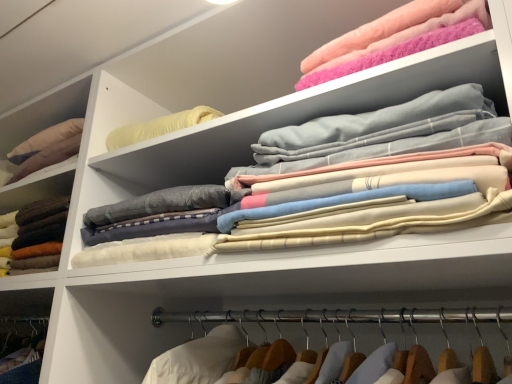
What do you see at coordinates (386, 202) in the screenshot? I see `soft cotton sheets at upper center, the 2th clothing when ordered from left to right` at bounding box center [386, 202].

Locate an element on the screen. soft wool sweater at left, which is the 3th clothing from right to left is located at coordinates (36, 236).

Could you tell me if fluffy pink towel at upper right, marked as the third clothing in a left-to-right arrangement, is turned towards soft wool sweater at left, placed as the 1th clothing when sorted from left to right?

No, fluffy pink towel at upper right, marked as the third clothing in a left-to-right arrangement, is not aimed at soft wool sweater at left, placed as the 1th clothing when sorted from left to right.

Is fluffy pink towel at upper right, arranged as the 1th clothing when viewed from the right, completely or partially outside of soft wool sweater at left, which is the 3th clothing from right to left?

That's correct, fluffy pink towel at upper right, arranged as the 1th clothing when viewed from the right, is outside of soft wool sweater at left, which is the 3th clothing from right to left.

Is fluffy pink towel at upper right, arranged as the 1th clothing when viewed from the right, wider or thinner than soft wool sweater at left, which is the 3th clothing from right to left?

Clearly, fluffy pink towel at upper right, arranged as the 1th clothing when viewed from the right, has less width compared to soft wool sweater at left, which is the 3th clothing from right to left.

From a real-world perspective, does fluffy pink towel at upper right, arranged as the 1th clothing when viewed from the right, stand above soft wool sweater at left, placed as the 1th clothing when sorted from left to right?

Correct, in the physical world, fluffy pink towel at upper right, arranged as the 1th clothing when viewed from the right, is higher than soft wool sweater at left, placed as the 1th clothing when sorted from left to right.

Starting from the soft wool sweater at left, placed as the 1th clothing when sorted from left to right, which clothing is the 2nd one in front? Please provide its 2D coordinates.

[(386, 202)]

Does soft wool sweater at left, placed as the 1th clothing when sorted from left to right, have a greater width compared to soft cotton sheets at upper center, the 2th clothing when ordered from left to right?

Yes.

Is soft wool sweater at left, which is the 3th clothing from right to left, touching soft cotton sheets at upper center, the 2th clothing when ordered from left to right?

soft wool sweater at left, which is the 3th clothing from right to left, is not next to soft cotton sheets at upper center, the 2th clothing when ordered from left to right, and they're not touching.

From the picture: Between soft wool sweater at left, placed as the 1th clothing when sorted from left to right, and soft cotton sheets at upper center, marked as the 2th clothing in a right-to-left arrangement, which one is positioned behind?

Positioned behind is soft wool sweater at left, placed as the 1th clothing when sorted from left to right.

Considering the positions of objects soft cotton sheets at upper center, marked as the 2th clothing in a right-to-left arrangement, and fluffy pink towel at upper right, arranged as the 1th clothing when viewed from the right, in the image provided, who is more to the left, soft cotton sheets at upper center, marked as the 2th clothing in a right-to-left arrangement, or fluffy pink towel at upper right, arranged as the 1th clothing when viewed from the right,?

From the viewer's perspective, soft cotton sheets at upper center, marked as the 2th clothing in a right-to-left arrangement, appears more on the left side.

Is soft cotton sheets at upper center, the 2th clothing when ordered from left to right, with fluffy pink towel at upper right, marked as the third clothing in a left-to-right arrangement?

No, soft cotton sheets at upper center, the 2th clothing when ordered from left to right, is not making contact with fluffy pink towel at upper right, marked as the third clothing in a left-to-right arrangement.

Is fluffy pink towel at upper right, arranged as the 1th clothing when viewed from the right, at the back of soft cotton sheets at upper center, the 2th clothing when ordered from left to right?

No, soft cotton sheets at upper center, the 2th clothing when ordered from left to right, is not facing away from fluffy pink towel at upper right, arranged as the 1th clothing when viewed from the right.

From the image's perspective, is fluffy pink towel at upper right, arranged as the 1th clothing when viewed from the right, on soft cotton sheets at upper center, marked as the 2th clothing in a right-to-left arrangement?

Indeed, from the image's perspective, fluffy pink towel at upper right, arranged as the 1th clothing when viewed from the right, is shown above soft cotton sheets at upper center, marked as the 2th clothing in a right-to-left arrangement.

Which object is wider, fluffy pink towel at upper right, marked as the third clothing in a left-to-right arrangement, or soft cotton sheets at upper center, the 2th clothing when ordered from left to right?

With larger width is fluffy pink towel at upper right, marked as the third clothing in a left-to-right arrangement.

Is fluffy pink towel at upper right, arranged as the 1th clothing when viewed from the right, oriented towards soft cotton sheets at upper center, marked as the 2th clothing in a right-to-left arrangement?

No, fluffy pink towel at upper right, arranged as the 1th clothing when viewed from the right, is not facing towards soft cotton sheets at upper center, marked as the 2th clothing in a right-to-left arrangement.

Which of these two, soft wool sweater at left, which is the 3th clothing from right to left, or fluffy pink towel at upper right, marked as the third clothing in a left-to-right arrangement, is bigger?

Bigger between the two is soft wool sweater at left, which is the 3th clothing from right to left.

Which is behind, point (32, 237) or point (447, 21)?

The point (32, 237) is farther.

From a real-world perspective, between soft wool sweater at left, which is the 3th clothing from right to left, and fluffy pink towel at upper right, marked as the third clothing in a left-to-right arrangement, who is vertically higher?

In real-world perspective, fluffy pink towel at upper right, marked as the third clothing in a left-to-right arrangement, is above.

Between soft cotton sheets at upper center, marked as the 2th clothing in a right-to-left arrangement, and soft wool sweater at left, placed as the 1th clothing when sorted from left to right, which one is positioned behind?

soft wool sweater at left, placed as the 1th clothing when sorted from left to right.

Does soft cotton sheets at upper center, the 2th clothing when ordered from left to right, have a greater height compared to soft wool sweater at left, placed as the 1th clothing when sorted from left to right?

Yes.

How different are the orientations of soft cotton sheets at upper center, marked as the 2th clothing in a right-to-left arrangement, and soft wool sweater at left, placed as the 1th clothing when sorted from left to right, in degrees?

They differ by 6.51 degrees in their facing directions.

You are a GUI agent. You are given a task and a screenshot of the screen. Output one action in this format:
    pyautogui.click(x=<x>, y=<y>)
    Task: Click on the 1st clothing in front of the soft wool sweater at left, placed as the 1th clothing when sorted from left to right, starting your count from the anchor
    This screenshot has height=384, width=512.
    Given the screenshot: What is the action you would take?
    pyautogui.click(x=387, y=41)

You are a GUI agent. You are given a task and a screenshot of the screen. Output one action in this format:
    pyautogui.click(x=<x>, y=<y>)
    Task: Click on the clothing below the soft cotton sheets at upper center, marked as the 2th clothing in a right-to-left arrangement (from the image's perspective)
    Image resolution: width=512 pixels, height=384 pixels.
    Given the screenshot: What is the action you would take?
    pyautogui.click(x=36, y=236)

Looking at the image, which one is located closer to fluffy pink towel at upper right, marked as the third clothing in a left-to-right arrangement, soft cotton sheets at upper center, marked as the 2th clothing in a right-to-left arrangement, or soft wool sweater at left, which is the 3th clothing from right to left?

soft cotton sheets at upper center, marked as the 2th clothing in a right-to-left arrangement, is positioned closer to the anchor fluffy pink towel at upper right, marked as the third clothing in a left-to-right arrangement.

Estimate the real-world distances between objects in this image. Which object is further from fluffy pink towel at upper right, marked as the third clothing in a left-to-right arrangement, soft wool sweater at left, placed as the 1th clothing when sorted from left to right, or soft cotton sheets at upper center, marked as the 2th clothing in a right-to-left arrangement?

Among the two, soft wool sweater at left, placed as the 1th clothing when sorted from left to right, is located further to fluffy pink towel at upper right, marked as the third clothing in a left-to-right arrangement.

Considering their positions, is soft wool sweater at left, which is the 3th clothing from right to left, positioned closer to soft cotton sheets at upper center, the 2th clothing when ordered from left to right, than fluffy pink towel at upper right, arranged as the 1th clothing when viewed from the right?

fluffy pink towel at upper right, arranged as the 1th clothing when viewed from the right, is closer to soft cotton sheets at upper center, the 2th clothing when ordered from left to right.

Looking at the image, which one is located closer to soft wool sweater at left, which is the 3th clothing from right to left, fluffy pink towel at upper right, arranged as the 1th clothing when viewed from the right, or soft cotton sheets at upper center, marked as the 2th clothing in a right-to-left arrangement?

soft cotton sheets at upper center, marked as the 2th clothing in a right-to-left arrangement.

Looking at the image, which one is located further to soft wool sweater at left, placed as the 1th clothing when sorted from left to right, soft cotton sheets at upper center, marked as the 2th clothing in a right-to-left arrangement, or fluffy pink towel at upper right, marked as the third clothing in a left-to-right arrangement?

The object further to soft wool sweater at left, placed as the 1th clothing when sorted from left to right, is fluffy pink towel at upper right, marked as the third clothing in a left-to-right arrangement.

Looking at the image, which one is located further to soft cotton sheets at upper center, marked as the 2th clothing in a right-to-left arrangement, fluffy pink towel at upper right, marked as the third clothing in a left-to-right arrangement, or soft wool sweater at left, placed as the 1th clothing when sorted from left to right?

Based on the image, soft wool sweater at left, placed as the 1th clothing when sorted from left to right, appears to be further to soft cotton sheets at upper center, marked as the 2th clothing in a right-to-left arrangement.

Where is `clothing between soft wool sweater at left, which is the 3th clothing from right to left, and fluffy pink towel at upper right, arranged as the 1th clothing when viewed from the right, from left to right`? clothing between soft wool sweater at left, which is the 3th clothing from right to left, and fluffy pink towel at upper right, arranged as the 1th clothing when viewed from the right, from left to right is located at coordinates (386, 202).